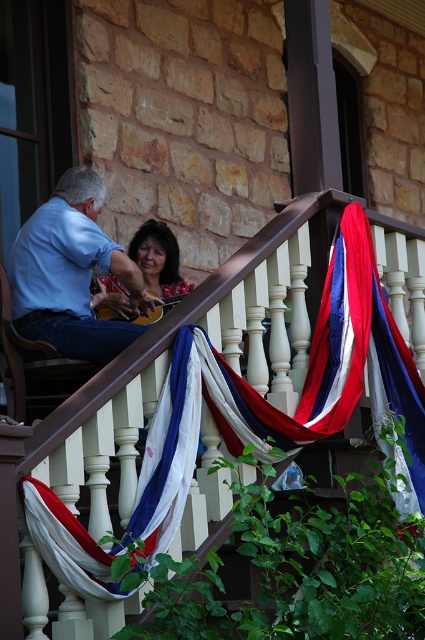
Who is higher up, blue denim jeans at left or matte black hair at upper center?

blue denim jeans at left

Which is in front, point (44, 214) or point (156, 237)?

Point (44, 214)

Image resolution: width=425 pixels, height=640 pixels. What are the coordinates of `blue denim jeans at left` in the screenshot? It's located at (71, 273).

Which is behind, point (224, 317) or point (51, 310)?

Positioned behind is point (51, 310).

Does white wood railing at upper center have a larger size compared to blue denim jeans at left?

Yes.

The height and width of the screenshot is (640, 425). In order to click on white wood railing at upper center in this screenshot , I will do `click(166, 372)`.

Locate an element on the screen. This screenshot has height=640, width=425. white wood railing at upper center is located at coordinates (166, 372).

Who is shorter, white wood railing at upper center or matte black hair at upper center?

Standing shorter between the two is matte black hair at upper center.

Is point (265, 387) behind point (144, 269)?

No, (265, 387) is in front of (144, 269).

Find the location of a particular element. white wood railing at upper center is located at coordinates (166, 372).